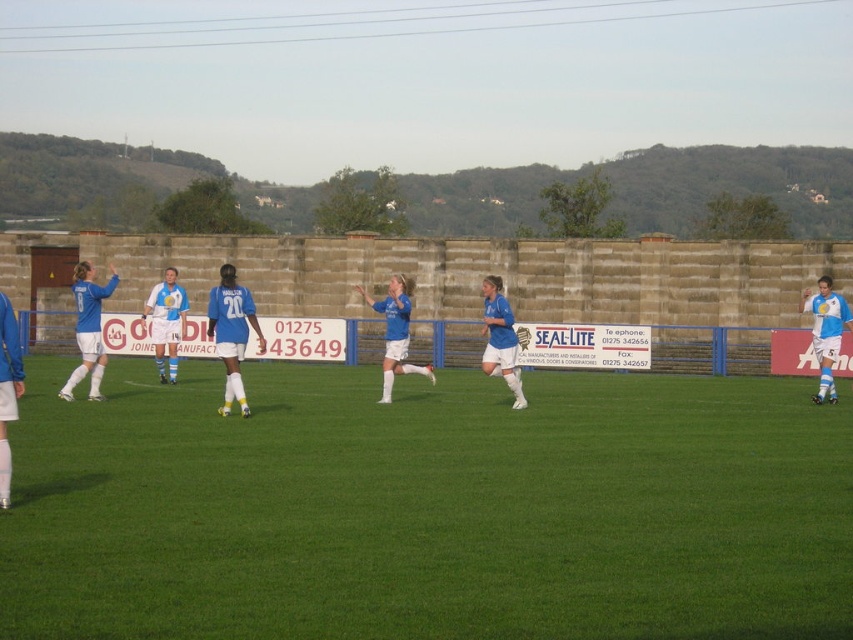
You are a soccer player positioned at the center of the field. You see the blue matte soccer ball at left. Where should you move to kick the ball towards the goal located at the right side of the field?

The blue matte soccer ball at left is located at point (88, 330), so you should move towards that coordinate to position yourself for a kick towards the goal on the right side of the field.

You are a soccer player standing on the field and want to kick the ball to the center of the field. Which direction should you kick the ball from the white matte soccer ball at right to reach the green grass at center?

You should kick the ball from the white matte soccer ball at right towards the left to reach the green grass at center because the ball is positioned at the right side of the field and the center is to the left of it.